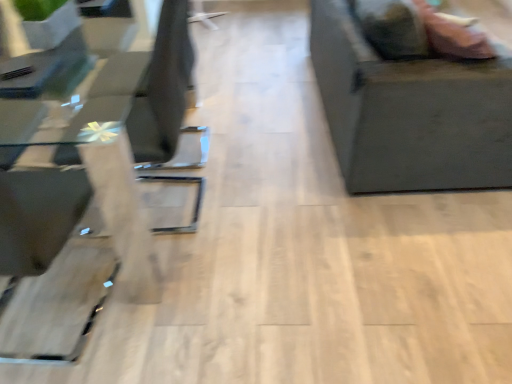
Question: Is transparent glass table at left spatially inside matte black couch at right, or outside of it?

Choices:
 (A) outside
 (B) inside

Answer: (A)

Question: In the image, is transparent glass table at left positioned in front of or behind matte black couch at right?

Choices:
 (A) behind
 (B) front

Answer: (B)

Question: Looking at the image, does transparent glass table at left seem bigger or smaller compared to matte black couch at right?

Choices:
 (A) big
 (B) small

Answer: (B)

Question: Looking at the image, does matte black couch at right seem bigger or smaller compared to transparent glass table at left?

Choices:
 (A) big
 (B) small

Answer: (A)

Question: Looking at their shapes, would you say matte black couch at right is wider or thinner than transparent glass table at left?

Choices:
 (A) wide
 (B) thin

Answer: (A)

Question: In terms of height, does matte black couch at right look taller or shorter compared to transparent glass table at left?

Choices:
 (A) short
 (B) tall

Answer: (B)

Question: Would you say matte black couch at right is to the left or to the right of transparent glass table at left in the picture?

Choices:
 (A) right
 (B) left

Answer: (A)